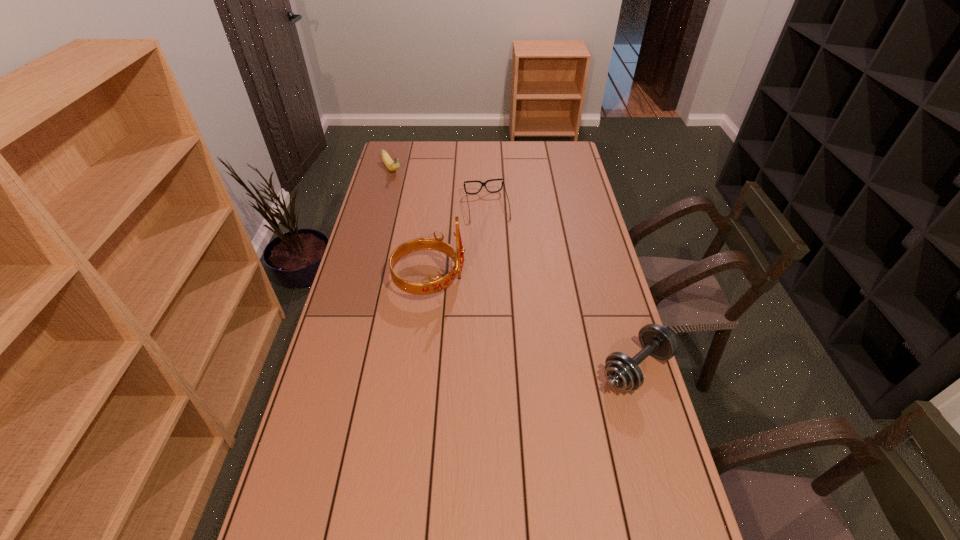
Identify the location of the tallest object. 437,284.

The width and height of the screenshot is (960, 540). I want to click on the third farthest object, so click(437, 284).

Identify the location of the rightmost object. [622, 372].

Where is `dumbbell`? Image resolution: width=960 pixels, height=540 pixels. dumbbell is located at coordinates (622, 372).

Locate an element on the screen. The height and width of the screenshot is (540, 960). banana is located at coordinates (392, 165).

Identify the location of the leftmost object. The image size is (960, 540). point(392,165).

Image resolution: width=960 pixels, height=540 pixels. Find the location of `the shortest object`. the shortest object is located at coordinates point(482,183).

You are a GUI agent. You are given a task and a screenshot of the screen. Output one action in this format:
    pyautogui.click(x=<x>, y=<y>)
    Task: Click on the second farthest object
    Image resolution: width=960 pixels, height=540 pixels.
    Given the screenshot: What is the action you would take?
    pyautogui.click(x=482, y=183)

Locate an element on the screen. This screenshot has width=960, height=540. vacant space located 0.360m on the front-facing side of the tallest object is located at coordinates (569, 279).

Find the location of a particular element. The image size is (960, 540). vacant region located 0.180m on the front of the dumbbell is located at coordinates (664, 465).